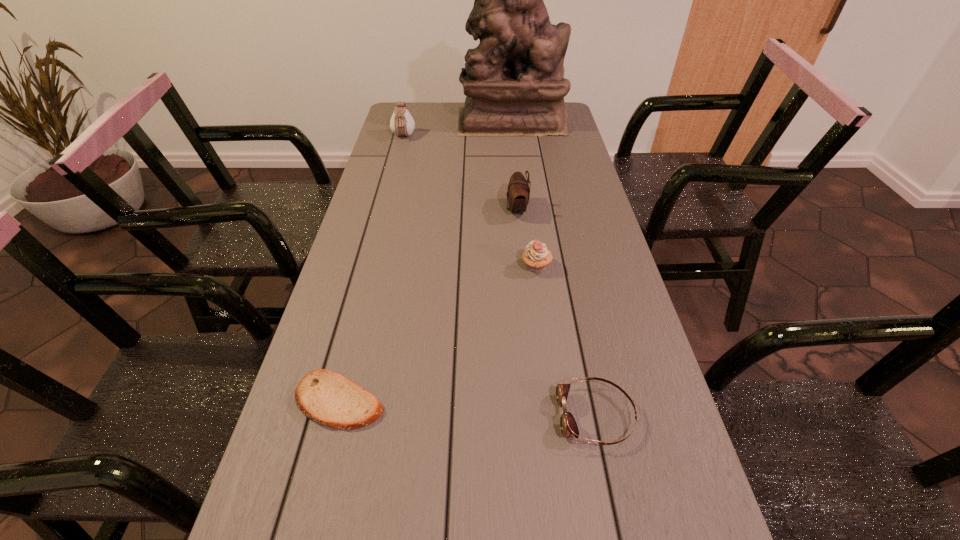
What are the coordinates of `free space located on the front-facing side of the tallest object` in the screenshot? It's located at (396, 121).

Locate an element on the screen. The image size is (960, 540). free space located on the front-facing side of the left pouch is located at coordinates (389, 191).

Identify the location of free space located 0.190m with the flap open on the nearer pouch. The image size is (960, 540). [444, 209].

Image resolution: width=960 pixels, height=540 pixels. I want to click on vacant space positioned 0.260m with the flap open on the nearer pouch, so click(x=420, y=209).

At what (x,y) coordinates should I click in order to perform the action: click on vacant region located with the flap open on the nearer pouch. Please return your answer as a coordinate pair (x, y). The image size is (960, 540). Looking at the image, I should click on (473, 209).

Where is `vacant space located 0.370m on the left of the cupcake`? vacant space located 0.370m on the left of the cupcake is located at coordinates (380, 266).

At what (x,y) coordinates should I click in order to perform the action: click on blank space located 0.070m through the lenses of the fifth tallest object. Please return your answer as a coordinate pair (x, y). Looking at the image, I should click on (521, 416).

You are a GUI agent. You are given a task and a screenshot of the screen. Output one action in this format:
    pyautogui.click(x=<x>, y=<y>)
    Task: Click on the vacant space located 0.320m through the lenses of the fifth tallest object
    The image size is (960, 540).
    Given the screenshot: What is the action you would take?
    pyautogui.click(x=393, y=416)

At what (x,y) coordinates should I click in order to perform the action: click on free location located 0.290m through the lenses of the fifth tallest object. Please return your answer as a coordinate pair (x, y). Looking at the image, I should click on (408, 416).

Locate an element on the screen. This screenshot has width=960, height=540. free space located 0.070m on the right of the shortest object is located at coordinates (420, 400).